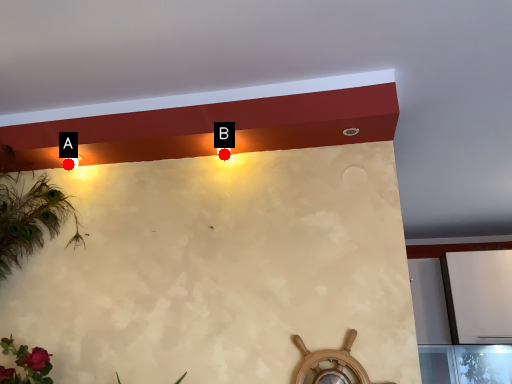
Question: Two points are circled on the image, labeled by A and B beside each circle. Which point is closer to the camera taking this photo?

Choices:
 (A) A is closer
 (B) B is closer

Answer: (B)